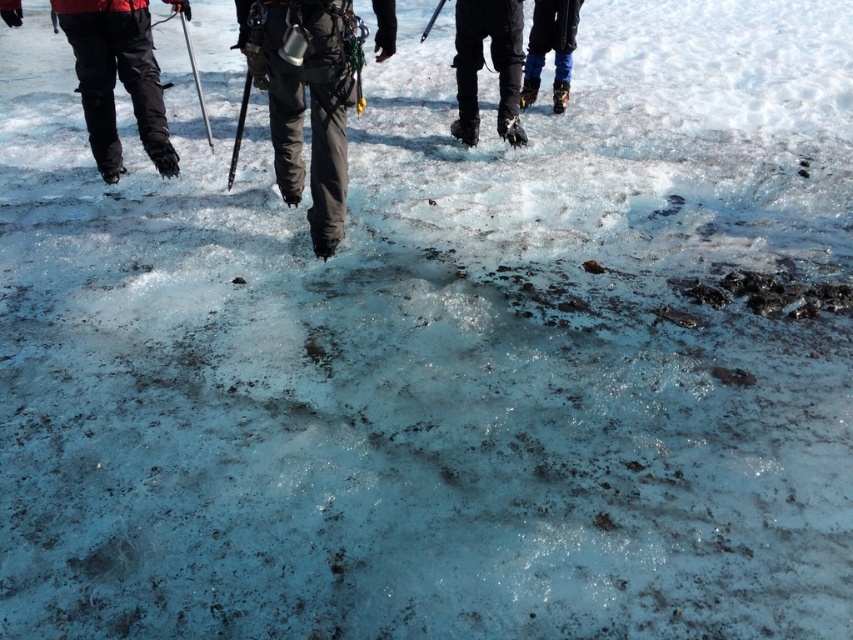
You are part of a group walking on a frozen glacier. You notice two people ahead of you. One has black rubber boots at upper center and the other has blue fabric pants at upper right. Which person is positioned more to the left side of your view?

The black rubber boots at upper center are to the left of the blue fabric pants at upper right, so the person with the black rubber boots at upper center is positioned more to the left side of your view.

You are a photographer trying to capture a clear shot of the black nylon pants at center and the blue fabric pants at upper right. Which pair of pants is closer to the camera?

The black nylon pants at center is positioned under the blue fabric pants at upper right, meaning the blue fabric pants at upper right are closer to the camera.